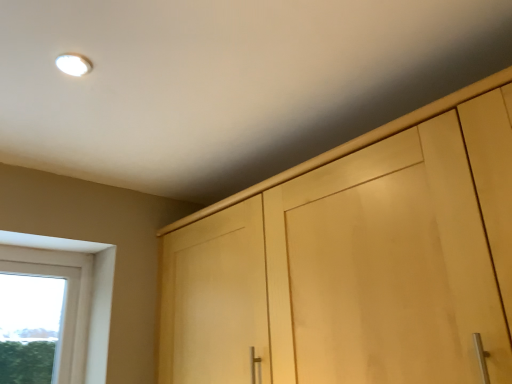
Describe the element at coordinates (355, 259) in the screenshot. The width and height of the screenshot is (512, 384). I see `light wood cupboard at upper right` at that location.

You are a GUI agent. You are given a task and a screenshot of the screen. Output one action in this format:
    pyautogui.click(x=<x>, y=<y>)
    Task: Click on the light wood cupboard at upper right
    The image size is (512, 384).
    Given the screenshot: What is the action you would take?
    pyautogui.click(x=355, y=259)

Identify the location of light wood cupboard at upper right. This screenshot has width=512, height=384. (355, 259).